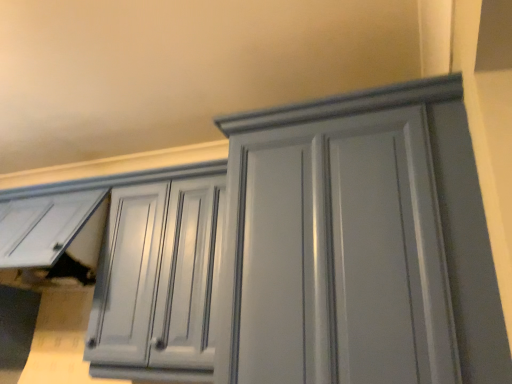
In order to face white glossy cabinet door at center, should I rotate leftwards or rightwards?

It's best to rotate right around 10.747 degrees.

Identify the location of white glossy cabinet door at center. The image size is (512, 384). pos(335,249).

Measure the distance between point (248, 243) and camera.

They are 4.01 feet apart.

What do you see at coordinates (335, 249) in the screenshot? I see `white glossy cabinet door at center` at bounding box center [335, 249].

Find the location of `white glossy cabinet door at center`. white glossy cabinet door at center is located at coordinates (335, 249).